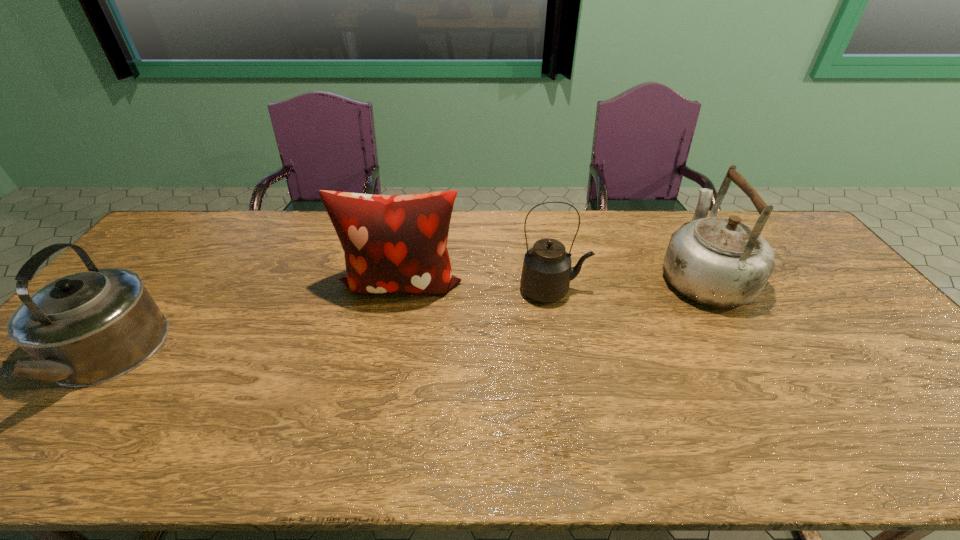
Locate an element on the screen. Image resolution: width=960 pixels, height=540 pixels. free location at the near edge is located at coordinates (146, 448).

At what (x,y) coordinates should I click in order to perform the action: click on free location at the left edge. Please return your answer as a coordinate pair (x, y). The image size is (960, 540). Looking at the image, I should click on (13, 401).

Locate an element on the screen. vacant space at the right edge is located at coordinates (909, 408).

This screenshot has width=960, height=540. In order to click on vacant space at the far left corner of the desktop in this screenshot , I will do `click(174, 239)`.

Locate an element on the screen. This screenshot has height=540, width=960. free space at the far right corner of the desktop is located at coordinates (756, 220).

Where is `empty location between the second kettle from left to right and the rightmost kettle`? Image resolution: width=960 pixels, height=540 pixels. empty location between the second kettle from left to right and the rightmost kettle is located at coordinates (628, 282).

Where is `vacant space that is in between the third object from right to left and the second kettle from left to right`? vacant space that is in between the third object from right to left and the second kettle from left to right is located at coordinates (477, 287).

At what (x,y) coordinates should I click in order to perform the action: click on object that is the nearest to the leftmost kettle. Please return your answer as a coordinate pair (x, y). The image size is (960, 540). Looking at the image, I should click on (393, 243).

Identify which object is the nearest to the second object from left to right. Please provide its 2D coordinates. Your answer should be formatted as a tuple, i.e. [(x, y)], where the tuple contains the x and y coordinates of a point satisfying the conditions above.

[(546, 274)]

Locate an element on the screen. The width and height of the screenshot is (960, 540). kettle that stands as the closest to the second kettle from left to right is located at coordinates (720, 262).